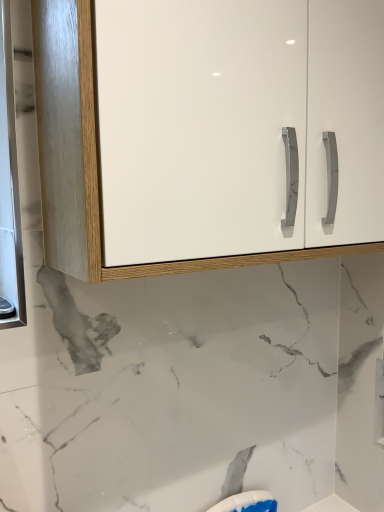
Question: From a real-world perspective, is white glossy cabinet at upper center located higher than white glossy medicine cabinet at left?

Choices:
 (A) yes
 (B) no

Answer: (A)

Question: Is white glossy cabinet at upper center taller than white glossy medicine cabinet at left?

Choices:
 (A) no
 (B) yes

Answer: (A)

Question: From the image's perspective, is white glossy cabinet at upper center on top of white glossy medicine cabinet at left?

Choices:
 (A) yes
 (B) no

Answer: (A)

Question: Can you confirm if white glossy cabinet at upper center is positioned to the right of white glossy medicine cabinet at left?

Choices:
 (A) no
 (B) yes

Answer: (B)

Question: From the image's perspective, does white glossy cabinet at upper center appear lower than white glossy medicine cabinet at left?

Choices:
 (A) yes
 (B) no

Answer: (B)

Question: Is white glossy cabinet at upper center at the left side of white glossy medicine cabinet at left?

Choices:
 (A) yes
 (B) no

Answer: (B)

Question: Can you confirm if white glossy medicine cabinet at left is taller than white glossy cabinet at upper center?

Choices:
 (A) no
 (B) yes

Answer: (B)

Question: From a real-world perspective, is white glossy medicine cabinet at left positioned over white glossy cabinet at upper center based on gravity?

Choices:
 (A) yes
 (B) no

Answer: (B)

Question: Does white glossy medicine cabinet at left have a smaller size compared to white glossy cabinet at upper center?

Choices:
 (A) yes
 (B) no

Answer: (A)

Question: Could you tell me if white glossy medicine cabinet at left is turned towards white glossy cabinet at upper center?

Choices:
 (A) no
 (B) yes

Answer: (A)

Question: Is white glossy medicine cabinet at left positioned with its back to white glossy cabinet at upper center?

Choices:
 (A) yes
 (B) no

Answer: (B)

Question: Is the depth of white glossy medicine cabinet at left greater than that of white glossy cabinet at upper center?

Choices:
 (A) no
 (B) yes

Answer: (B)

Question: From a real-world perspective, is white glossy medicine cabinet at left above or below white glossy cabinet at upper center?

Choices:
 (A) below
 (B) above

Answer: (A)